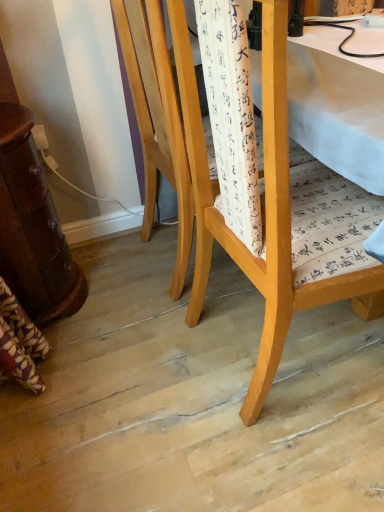
Question: Which direction should I rotate to face light wood chair at center, which is the 1th chair from back to front, — up or down?

Choices:
 (A) down
 (B) up

Answer: (B)

Question: Can you confirm if light wood chair at center, the 2th chair viewed from the back, is shorter than light wood chair at center, which is the 1th chair from back to front?

Choices:
 (A) yes
 (B) no

Answer: (B)

Question: Can you confirm if light wood chair at center, the 2th chair viewed from the back, is positioned to the right of light wood chair at center, the 2th chair positioned from the front?

Choices:
 (A) no
 (B) yes

Answer: (B)

Question: From the image's perspective, would you say light wood chair at center, the 1th chair from the front, is positioned over light wood chair at center, the 2th chair positioned from the front?

Choices:
 (A) yes
 (B) no

Answer: (B)

Question: Is light wood chair at center, the 2th chair viewed from the back, not close to light wood chair at center, which is the 1th chair from back to front?

Choices:
 (A) no
 (B) yes

Answer: (A)

Question: Is light wood chair at center, the 2th chair viewed from the back, to the left of light wood chair at center, the 2th chair positioned from the front, from the viewer's perspective?

Choices:
 (A) yes
 (B) no

Answer: (B)

Question: Is light wood chair at center, the 1th chair from the front, next to light wood chair at center, the 2th chair positioned from the front?

Choices:
 (A) yes
 (B) no

Answer: (B)

Question: Can you confirm if light wood chair at center, the 2th chair positioned from the front, is smaller than light wood chair at center, the 2th chair viewed from the back?

Choices:
 (A) yes
 (B) no

Answer: (B)

Question: Can you confirm if light wood chair at center, which is the 1th chair from back to front, is wider than light wood chair at center, the 1th chair from the front?

Choices:
 (A) yes
 (B) no

Answer: (A)

Question: Could you tell me if light wood chair at center, which is the 1th chair from back to front, is facing light wood chair at center, the 1th chair from the front?

Choices:
 (A) no
 (B) yes

Answer: (A)

Question: Does light wood chair at center, the 2th chair positioned from the front, have a larger size compared to light wood chair at center, the 1th chair from the front?

Choices:
 (A) yes
 (B) no

Answer: (A)

Question: Is the surface of light wood chair at center, the 2th chair positioned from the front, in direct contact with light wood chair at center, the 2th chair viewed from the back?

Choices:
 (A) no
 (B) yes

Answer: (A)

Question: Can you confirm if light wood chair at center, which is the 1th chair from back to front, is taller than light wood chair at center, the 1th chair from the front?

Choices:
 (A) yes
 (B) no

Answer: (B)

Question: Is light wood chair at center, the 1th chair from the front, inside the boundaries of light wood chair at center, which is the 1th chair from back to front, or outside?

Choices:
 (A) inside
 (B) outside

Answer: (B)